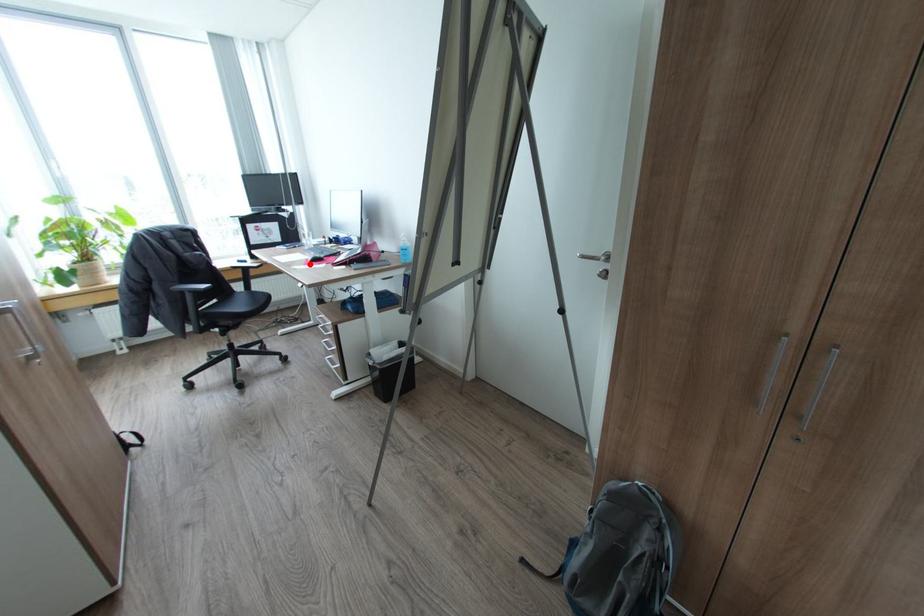
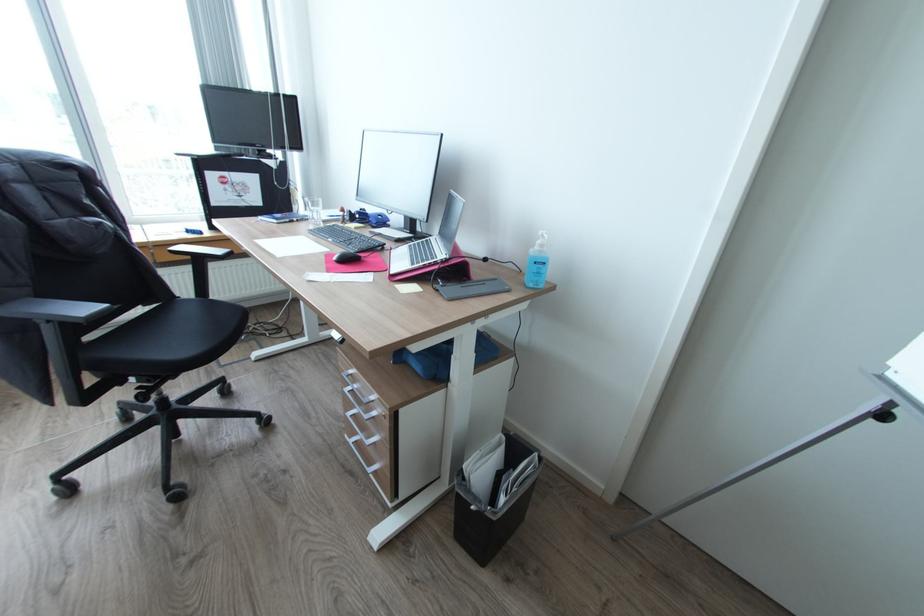
Find the pixel in the second image that matches the highlighted location in the first image.

(334, 270)